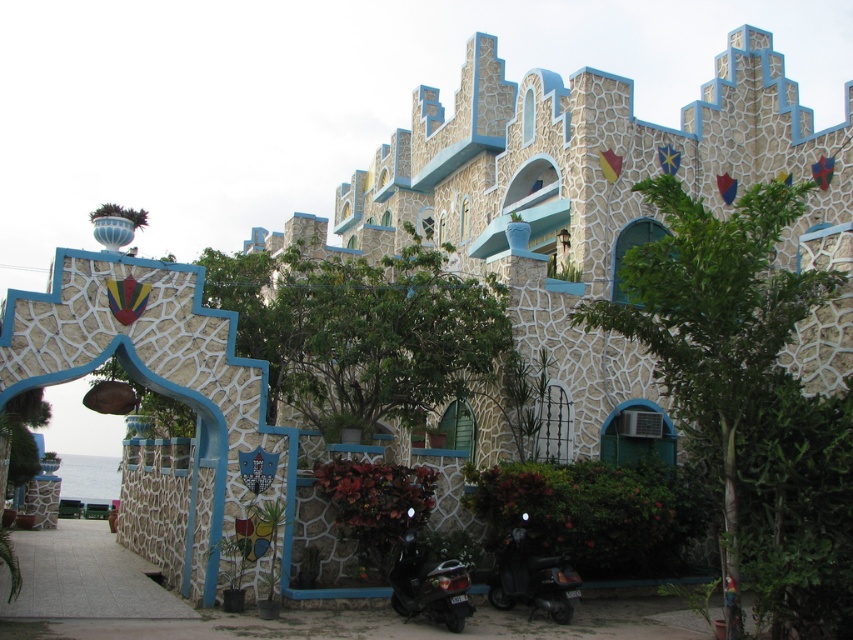
You are a visitor arriving at the castle entrance and see both the black glossy scooter at lower right and the shiny black scooter at lower center parked nearby. Which scooter is shorter in height?

The black glossy scooter at lower right is not as tall as the shiny black scooter at lower center, so the black glossy scooter at lower right is shorter in height.

You are standing at the entrance of the castle structure and want to park your scooter. You have two scooters here, the black glossy scooter at lower right and the shiny black scooter at lower center. Which scooter is closer to you so you can reach it first?

The black glossy scooter at lower right is closer to you, so you can reach it first because it is further to the viewer than the shiny black scooter at lower center.

You are a visitor arriving at the castle entrance and see both the black glossy scooter at lower right and the shiny black scooter at lower center parked nearby. Which scooter is smaller in size?

The black glossy scooter at lower right is smaller in size compared to the shiny black scooter at lower center.